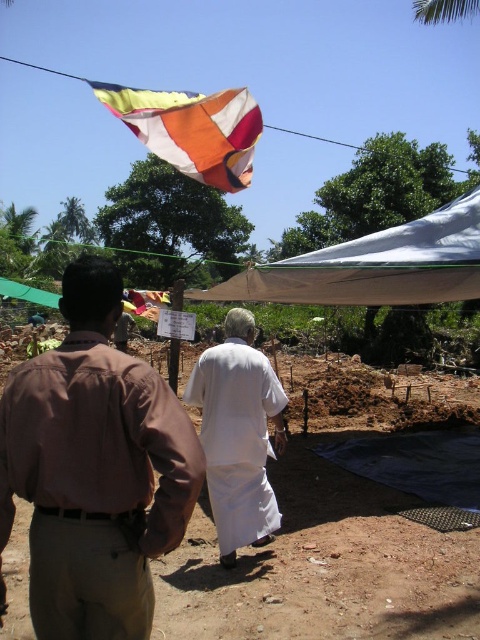
You are a photographer trying to capture a clear shot of the white cotton robe at center without the brown cotton shirt at center blocking it. What should you do?

The brown cotton shirt at center is in front of the white cotton robe at center, so you should move your position to the side or angle your camera to avoid the obstruction caused by the brown cotton shirt at center.

You are standing at the point with coordinates point [188,112] and want to walk towards the point with coordinates point [207,612]. Which direction should you face to move directly towards your destination?

You should face towards the direction of point [207,612], which is in front of point [188,112], so you need to walk forward towards it.